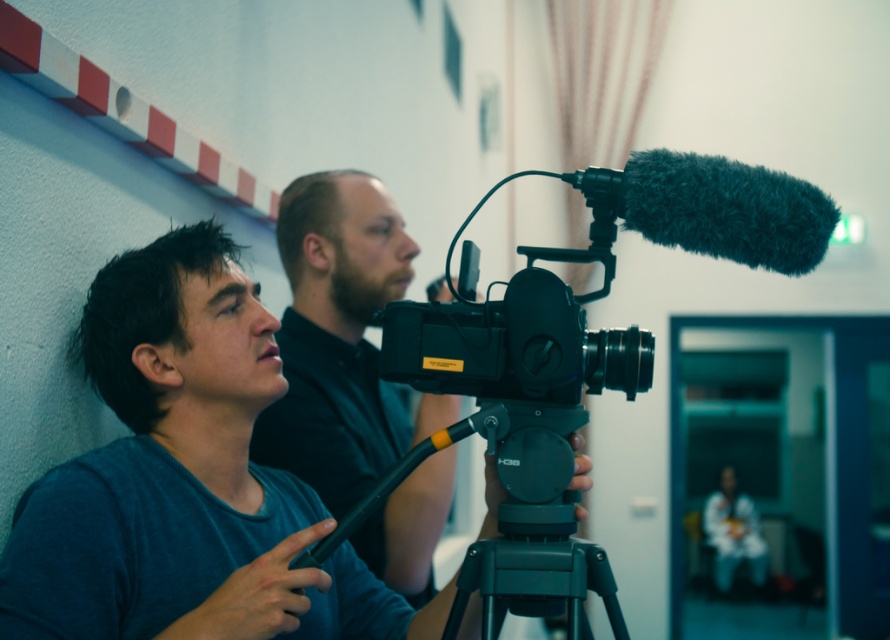
You are standing at the origin point in the middle of the room. There are two points marked in the image, point A at point (673, 230) and point B at point (721, 484). Which point is closer to you?

Point A at point (673, 230) is in front of point B at point (721, 484), so point A is closer to you.

You are setting up a photography studio and have a limited space. You need to place the black matte video camera at center and the white fabric at lower right. Given their sizes, which object requires more horizontal space?

The black matte video camera at center requires more horizontal space because its width surpasses that of the white fabric at lower right.